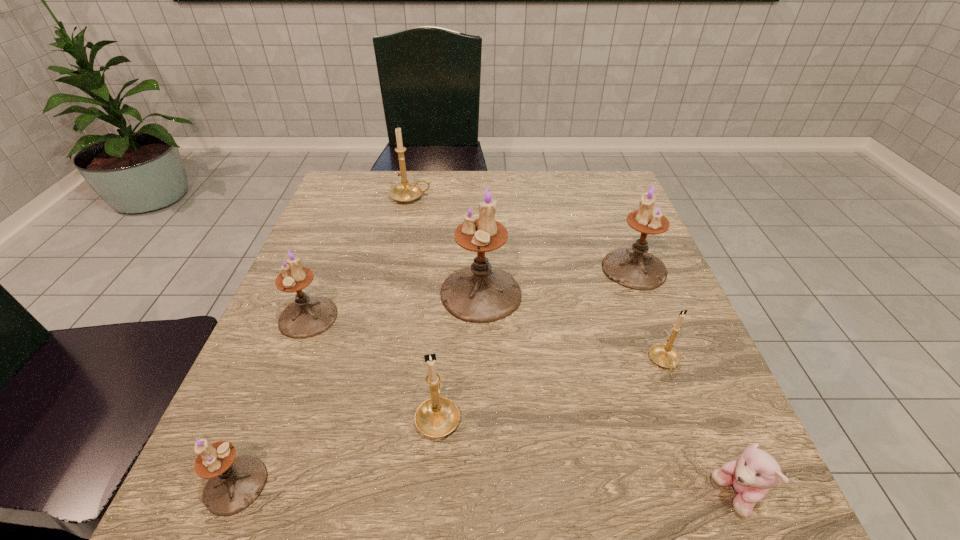
Locate an element on the screen. The image size is (960, 540). the nearest purple candle holder is located at coordinates (234, 483).

At what (x,y) coordinates should I click in order to perform the action: click on the nearest candle holder. Please return your answer as a coordinate pair (x, y). The height and width of the screenshot is (540, 960). Looking at the image, I should click on (234, 483).

The height and width of the screenshot is (540, 960). What are the coordinates of `teddy bear` in the screenshot? It's located at (751, 476).

The width and height of the screenshot is (960, 540). Identify the location of the shortest object. (751, 476).

Where is `vacant space located 0.240m on the front of the third purple candle holder from left to right`? vacant space located 0.240m on the front of the third purple candle holder from left to right is located at coordinates (481, 440).

At what (x,y) coordinates should I click in order to perform the action: click on vacant space located on the handle side of the farthest object. Please return your answer as a coordinate pair (x, y). The image size is (960, 540). Looking at the image, I should click on (458, 198).

Locate an element on the screen. free spot located 0.400m on the left of the third smallest purple candle holder is located at coordinates (421, 268).

This screenshot has height=540, width=960. I want to click on free space located on the back of the second smallest purple candle holder, so click(x=344, y=226).

Locate an element on the screen. vacant position located 0.050m on the handle side of the sixth farthest candle holder is located at coordinates (442, 367).

Identify the location of blank area located on the handle side of the sixth farthest candle holder. The height and width of the screenshot is (540, 960). (446, 313).